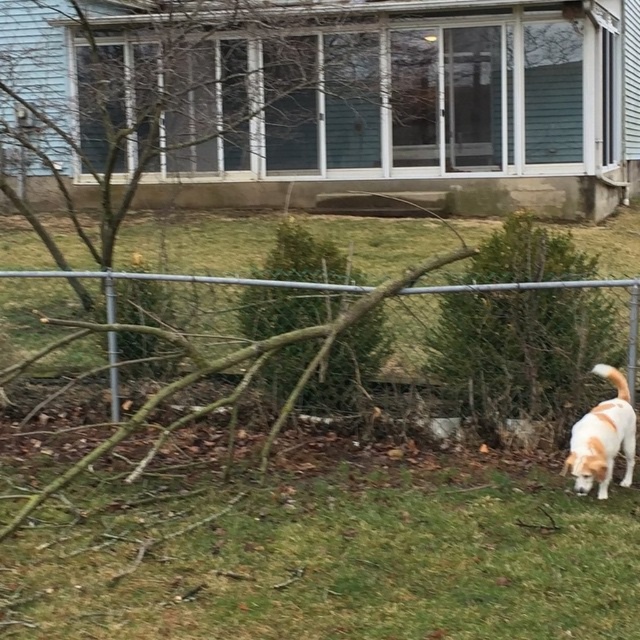
Question: Considering the real-world distances, which object is closest to the green grass at lower right?

Choices:
 (A) white fur dog at lower right
 (B) brown textured tree at center
 (C) metallic silver fence at center

Answer: (A)

Question: Does green grass at lower right appear on the left side of brown textured tree at center?

Choices:
 (A) yes
 (B) no

Answer: (A)

Question: Which point is farther from the camera taking this photo?

Choices:
 (A) click(x=611, y=458)
 (B) click(x=593, y=298)
 (C) click(x=6, y=273)

Answer: (C)

Question: Which object appears farthest from the camera in this image?

Choices:
 (A) white fur dog at lower right
 (B) brown textured tree at center
 (C) metallic silver fence at center
 (D) green grass at lower right

Answer: (B)

Question: Does metallic silver fence at center appear under white fur dog at lower right?

Choices:
 (A) yes
 (B) no

Answer: (B)

Question: Can you confirm if green grass at lower right is wider than white fur dog at lower right?

Choices:
 (A) no
 (B) yes

Answer: (B)